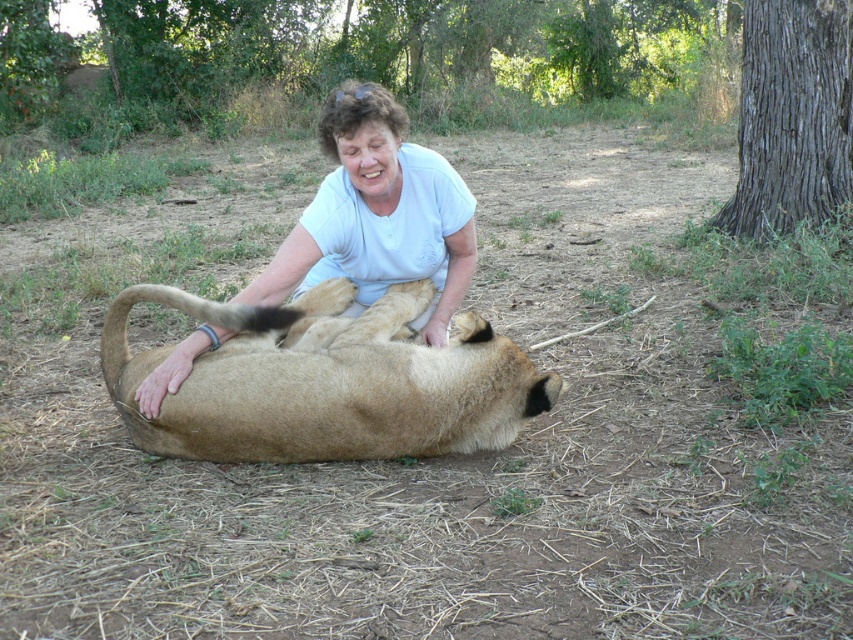
Is point (126, 353) behind point (409, 243)?

No.

Is point (375, 381) positioned before point (314, 278)?

Yes, point (375, 381) is in front of point (314, 278).

The height and width of the screenshot is (640, 853). I want to click on golden fur lion at center, so click(328, 381).